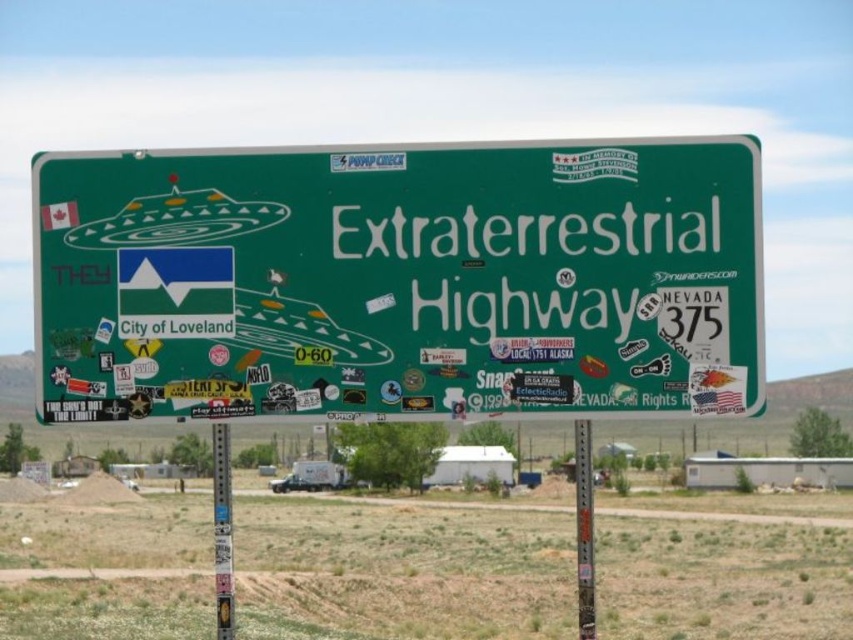
You are a traveler driving along the Extraterrestrial Highway in Nevada. You see a point marked at coordinates (222, 531) on your map. What object is located at this point?

The point at coordinates (222, 531) marks the location of the metallic pole at lower center.

You are a delivery driver who needs to park your truck between the green matte highway sign at center and the metallic pole at lower center. Your truck is 15 feet long. Is there enough space between them to park your truck?

The distance between the green matte highway sign at center and the metallic pole at lower center is 7.59 feet, which is shorter than the truck length of 15 feet. Therefore, the truck cannot be parked between them.